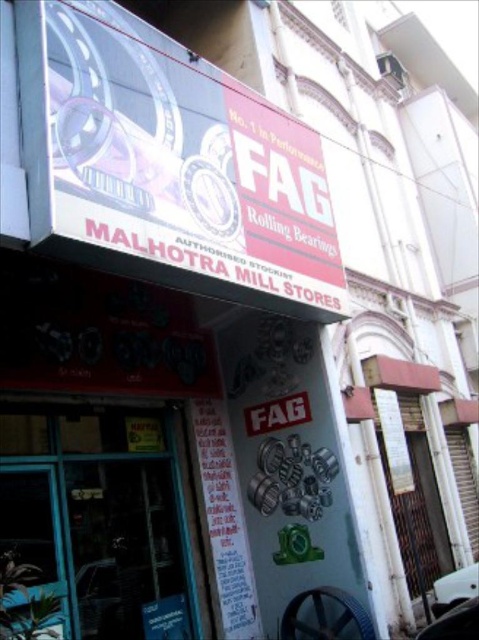
Question: Among these points, which one is nearest to the camera?

Choices:
 (A) (110, 230)
 (B) (246, 636)

Answer: (A)

Question: Is white paper at center to the left of white matte signboard at center from the viewer's perspective?

Choices:
 (A) yes
 (B) no

Answer: (A)

Question: Can you confirm if white glossy signboard at upper center is thinner than white matte car at lower right?

Choices:
 (A) no
 (B) yes

Answer: (A)

Question: Is the position of black matte car at lower right less distant than that of white matte car at lower right?

Choices:
 (A) no
 (B) yes

Answer: (B)

Question: Which point is farther from the camera taking this photo?

Choices:
 (A) (298, 300)
 (B) (451, 627)
 (C) (80, 58)
 (D) (214, 401)

Answer: (D)

Question: Which of the following is the farthest from the observer?

Choices:
 (A) white paper at center
 (B) white matte signboard at center
 (C) white matte car at lower right

Answer: (C)